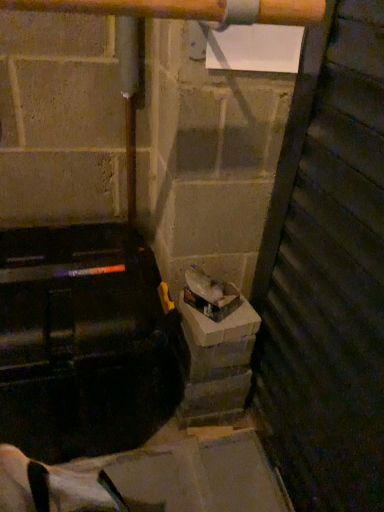
Question: Considering the relative sizes of wooden door at right and concreteroughconcrete block at center in the image provided, is wooden door at right taller than concreteroughconcrete block at center?

Choices:
 (A) yes
 (B) no

Answer: (A)

Question: Is wooden door at right in contact with concreteroughconcrete block at center?

Choices:
 (A) no
 (B) yes

Answer: (A)

Question: Can you confirm if wooden door at right is positioned to the left of concreteroughconcrete block at center?

Choices:
 (A) yes
 (B) no

Answer: (B)

Question: Can concreteroughconcrete block at center be found inside wooden door at right?

Choices:
 (A) yes
 (B) no

Answer: (B)

Question: Is wooden door at right turned away from concreteroughconcrete block at center?

Choices:
 (A) no
 (B) yes

Answer: (A)

Question: From the image's perspective, is wooden door at right located beneath concreteroughconcrete block at center?

Choices:
 (A) yes
 (B) no

Answer: (B)

Question: Are shiny plastic bag at center and wooden door at right located far from each other?

Choices:
 (A) yes
 (B) no

Answer: (B)

Question: From a real-world perspective, is shiny plastic bag at center over wooden door at right?

Choices:
 (A) yes
 (B) no

Answer: (B)

Question: Is wooden door at right at the back of shiny plastic bag at center?

Choices:
 (A) no
 (B) yes

Answer: (A)

Question: Can you confirm if shiny plastic bag at center is positioned to the left of wooden door at right?

Choices:
 (A) no
 (B) yes

Answer: (B)

Question: Does shiny plastic bag at center come behind wooden door at right?

Choices:
 (A) yes
 (B) no

Answer: (A)

Question: From the image's perspective, is shiny plastic bag at center on top of wooden door at right?

Choices:
 (A) no
 (B) yes

Answer: (B)

Question: Is wooden door at right positioned with its back to shiny plastic bag at center?

Choices:
 (A) no
 (B) yes

Answer: (B)